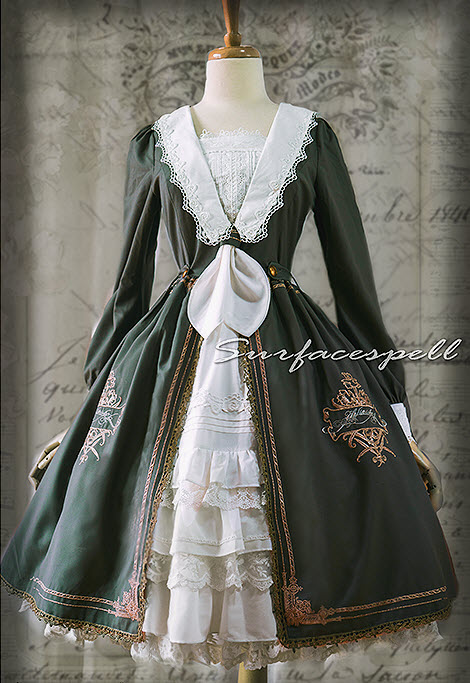
Find the location of a particular element. book is located at coordinates (406, 679).